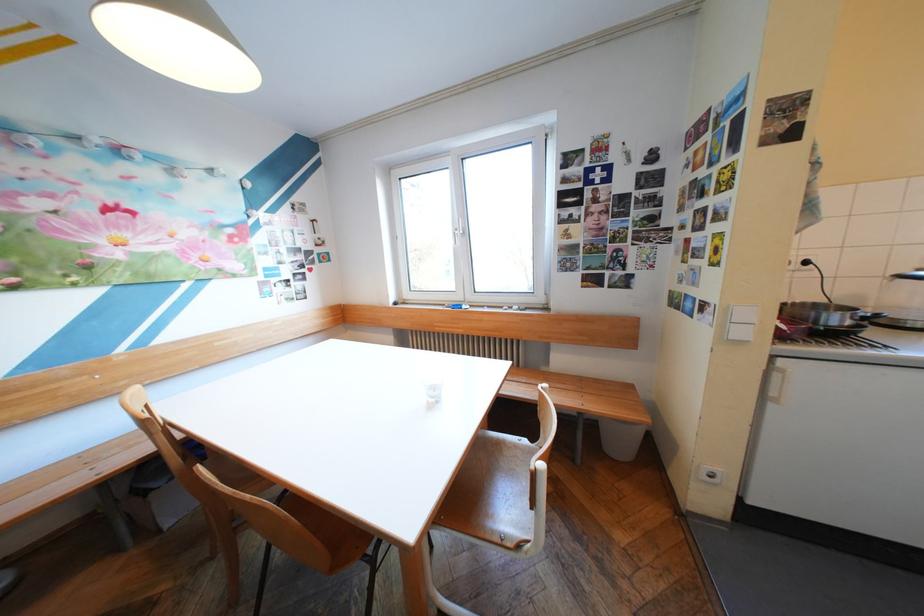
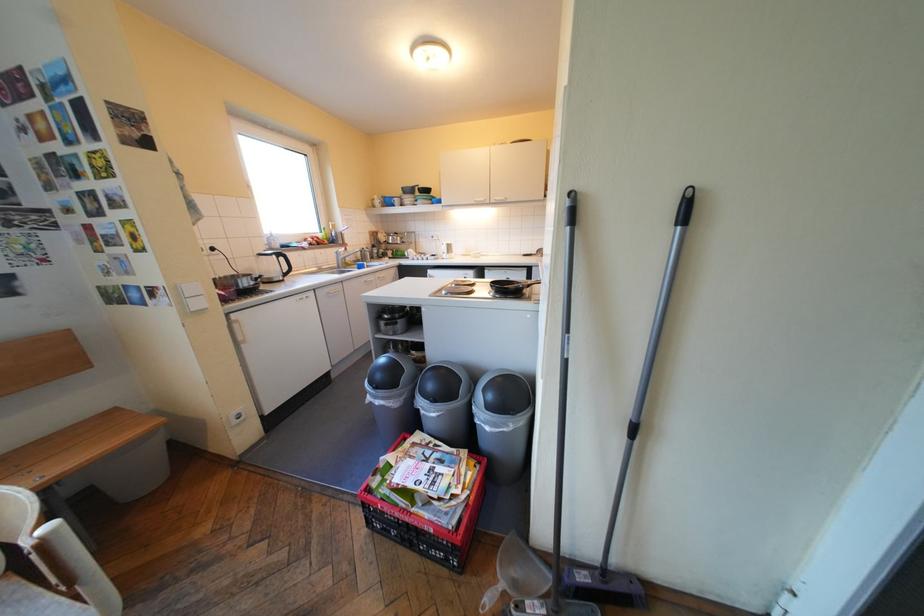
First-person continuous shooting, in which direction is the camera rotating?

The camera rotated toward right-down.